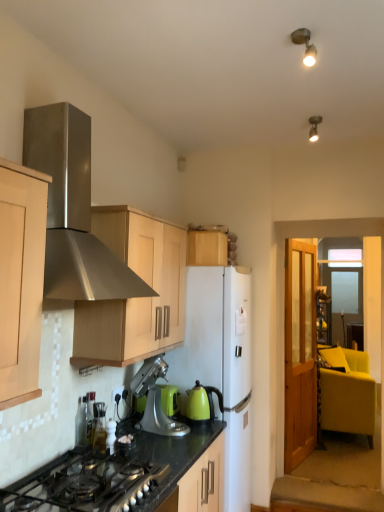
Question: Considering the positions of black granite countertop at lower center and silver metallic stand mixer at center, the second kitchen appliance in the right-to-left sequence, in the image, is black granite countertop at lower center wider or thinner than silver metallic stand mixer at center, the second kitchen appliance in the right-to-left sequence,?

Choices:
 (A) wide
 (B) thin

Answer: (A)

Question: Is point (215, 500) positioned closer to the camera than point (147, 430)?

Choices:
 (A) farther
 (B) closer

Answer: (B)

Question: Estimate the real-world distances between objects in this image. Which object is farther from the black matte gas stove at lower left?

Choices:
 (A) brushed metal toaster at lower left, marked as the 1th appliance in a left-to-right arrangement
 (B) matte silver spotlight at upper center, which is the first light fixture in right-to-left order
 (C) white matte refrigerator at center
 (D) green matte kettle at center, the 2th kitchen appliance positioned from the left
 (E) clear glass bottle at center, which ranks as the third appliance in back-to-front order

Answer: (B)

Question: Which is nearer to the green matte kettle at center, the 1th kitchen appliance in the right-to-left sequence?

Choices:
 (A) metallic spot light at upper right, the 1th light fixture viewed from the left
 (B) stainless steel range hood at upper left
 (C) matte silver spotlight at upper center, which is the first light fixture in right-to-left order
 (D) brushed metal toaster at lower left, which ranks as the third appliance in right-to-left order
 (E) matte yellow armchair at right

Answer: (D)